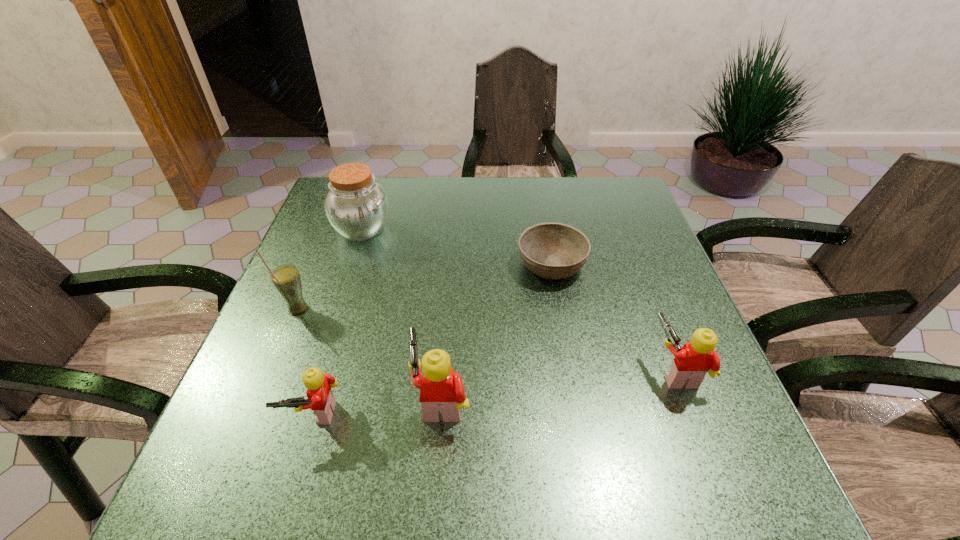
Find the location of `vacant space located 0.340m in front of the fourth object from left to right with the accessory visible`. vacant space located 0.340m in front of the fourth object from left to right with the accessory visible is located at coordinates (229, 399).

Where is `free space located in front of the fourth object from left to right with the accessory visible`? This screenshot has width=960, height=540. free space located in front of the fourth object from left to right with the accessory visible is located at coordinates (331, 399).

The width and height of the screenshot is (960, 540). Identify the location of free space located 0.120m in front of the rightmost object with the accessory visible. (590, 371).

This screenshot has width=960, height=540. Find the location of `vacant space situated in front of the rightmost object with the accessory visible`. vacant space situated in front of the rightmost object with the accessory visible is located at coordinates coord(530,371).

Find the location of a particular element. Image resolution: width=960 pixels, height=540 pixels. vacant space located in front of the rightmost object with the accessory visible is located at coordinates (570, 371).

Locate an element on the screen. The width and height of the screenshot is (960, 540). free space located on the back of the straw for drinking is located at coordinates (330, 231).

The width and height of the screenshot is (960, 540). I want to click on vacant space located on the right of the jar, so click(x=429, y=230).

Where is `vacant space located on the left of the second object from right to left`? vacant space located on the left of the second object from right to left is located at coordinates (448, 264).

Image resolution: width=960 pixels, height=540 pixels. I want to click on object located at the far edge, so click(357, 207).

At what (x,y) coordinates should I click in order to perform the action: click on Lego that is positioned at the left edge. Please return your answer as a coordinate pair (x, y). The width and height of the screenshot is (960, 540). Looking at the image, I should click on (321, 400).